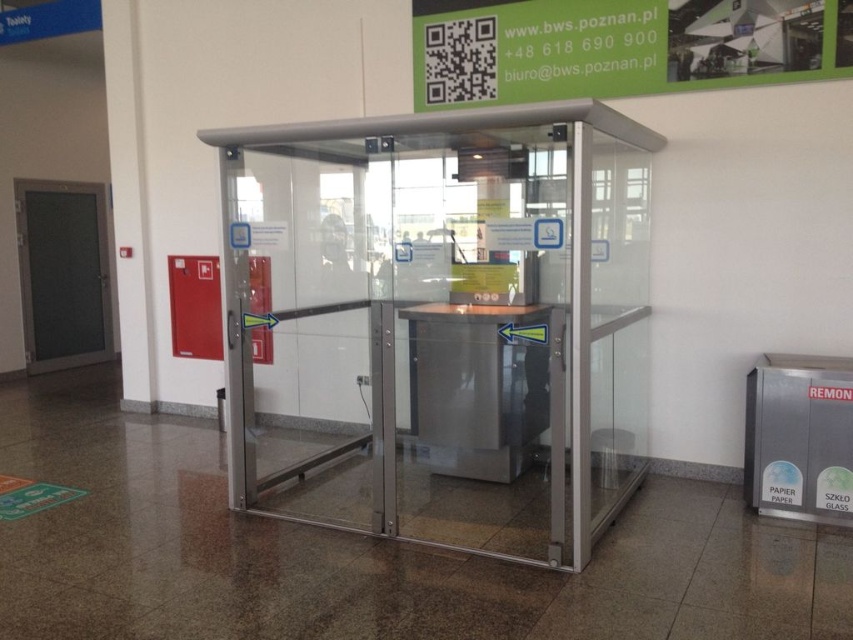
Question: Which object appears farthest from the camera in this image?

Choices:
 (A) metallic door at left
 (B) transparent glass door at center

Answer: (A)

Question: Which object appears closest to the camera in this image?

Choices:
 (A) metallic door at left
 (B) transparent glass door at center

Answer: (B)

Question: Can you confirm if transparent glass door at center is smaller than metallic door at left?

Choices:
 (A) yes
 (B) no

Answer: (B)

Question: Is transparent glass door at center bigger than metallic door at left?

Choices:
 (A) no
 (B) yes

Answer: (B)

Question: Is transparent glass door at center positioned before metallic door at left?

Choices:
 (A) yes
 (B) no

Answer: (A)